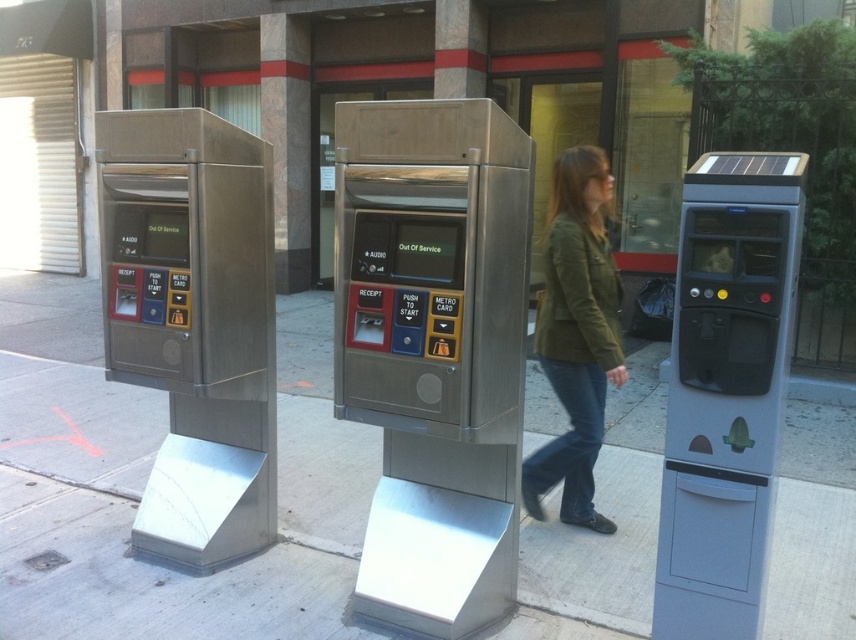
Does metallic atm at center appear on the left side of brushed metal pavement at center?

Indeed, metallic atm at center is positioned on the left side of brushed metal pavement at center.

Between metallic atm at center and brushed metal pavement at center, which one appears on the right side from the viewer's perspective?

Positioned to the right is brushed metal pavement at center.

Locate an element on the screen. Image resolution: width=856 pixels, height=640 pixels. metallic atm at center is located at coordinates (434, 349).

Who is lower down, brushed metal pavement at center or gray plastic parking meter at right?

brushed metal pavement at center is below.

Who is higher up, brushed metal pavement at center or gray plastic parking meter at right?

gray plastic parking meter at right

Does point (654, 461) lie in front of point (681, 333)?

No, it is not.

This screenshot has height=640, width=856. Identify the location of brushed metal pavement at center. (68, 388).

Is brushed metal pavement at center positioned behind olive green jacket at center?

Yes, brushed metal pavement at center is further from the viewer.

Can you confirm if brushed metal pavement at center is shorter than olive green jacket at center?

Correct, brushed metal pavement at center is not as tall as olive green jacket at center.

The height and width of the screenshot is (640, 856). I want to click on brushed metal pavement at center, so click(68, 388).